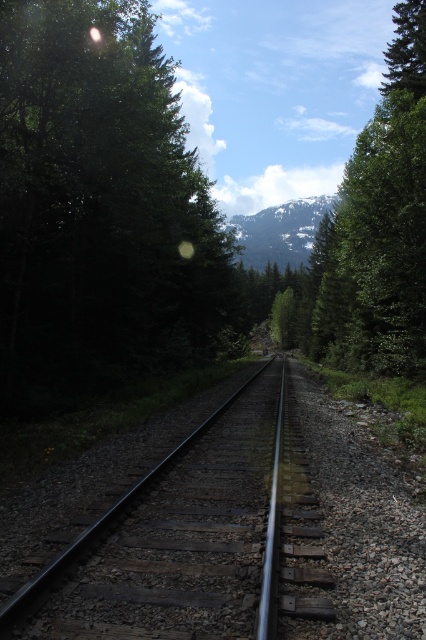
Based on the photo, you are standing on the railway track and see the green matte tree at left and the snowy rocky mountain at center. Which object is positioned to the left of the other?

The green matte tree at left is to the left of the snowy rocky mountain at center.

Consider the image. You are a hiker standing at the center of the railway track and see the green matte tree at left and the green textured tree at upper right. Which tree would you say is wider in appearance?

The green textured tree at upper right is wider than the green matte tree at left.

You are a hiker planning to take a photo of the snowy rocky mountain at center while standing near the green matte tree at left. Will the tree block your view of the mountain?

The green matte tree at left occupies less space than snowy rocky mountain at center, so the tree is smaller and less likely to block your view of the mountain.